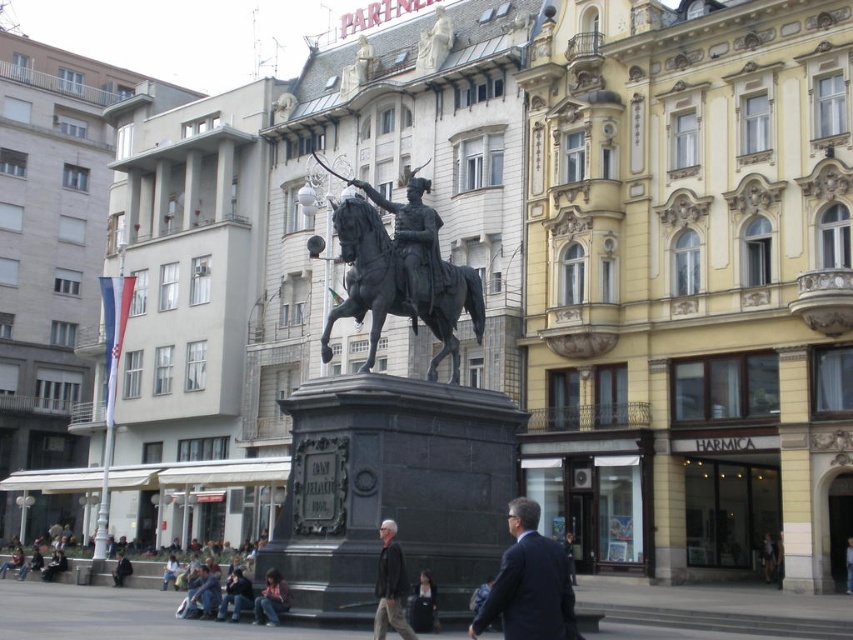
You are a tourist standing in the urban square and want to take a photo of the equestrian statue. To ensure the dark gray suit at center is in the frame, where should you position yourself relative to the statue?

Position yourself directly in front of the equestrian statue, aligning your camera with the dark gray suit at center located at coordinates approximately 0.912 on the x and 0.621 on the y axis. This central positioning ensures the statue and the suit are both prominently featured in the photo.